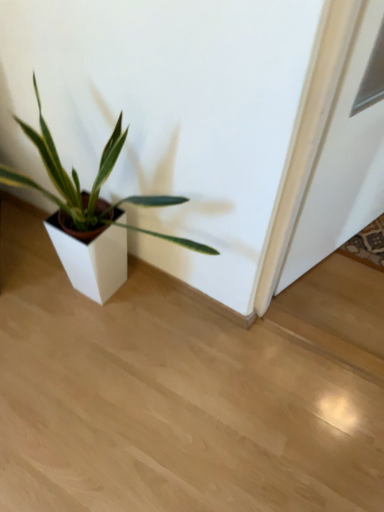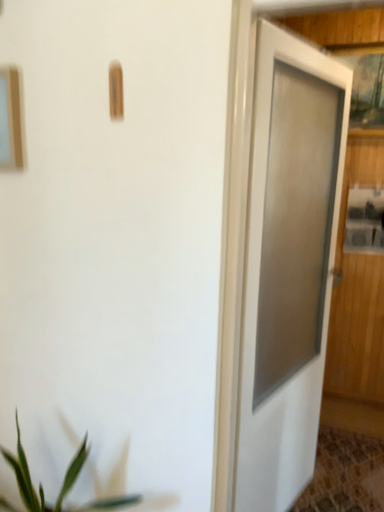
Question: Which way did the camera rotate in the video?

Choices:
 (A) rotated upward
 (B) rotated downward

Answer: (A)